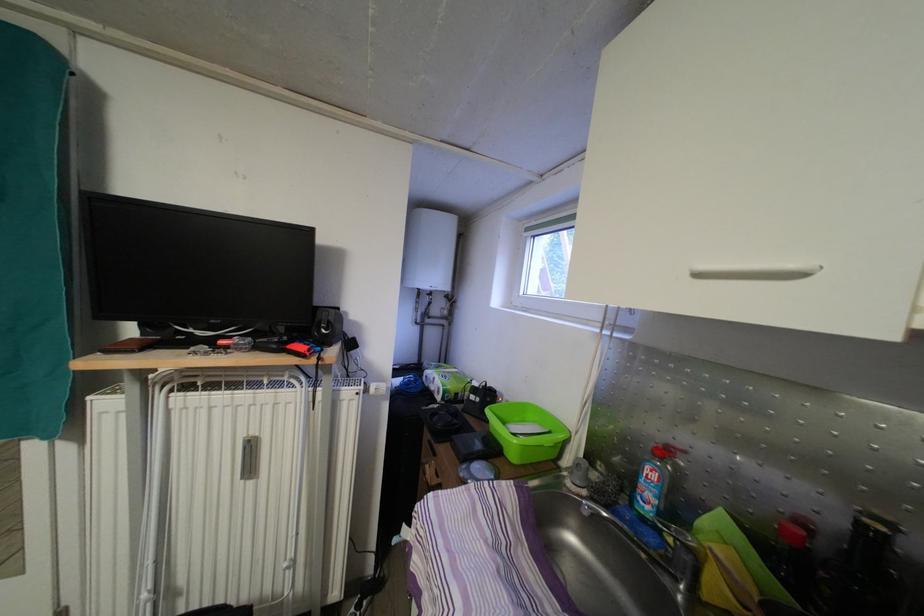
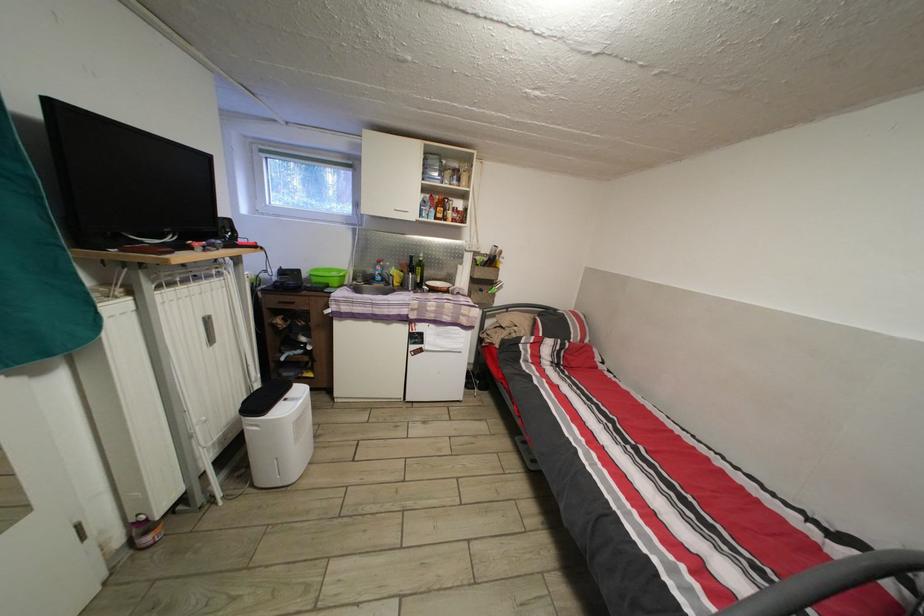
The point at (533, 236) is marked in the first image. Where is the corresponding point in the second image?

(269, 156)